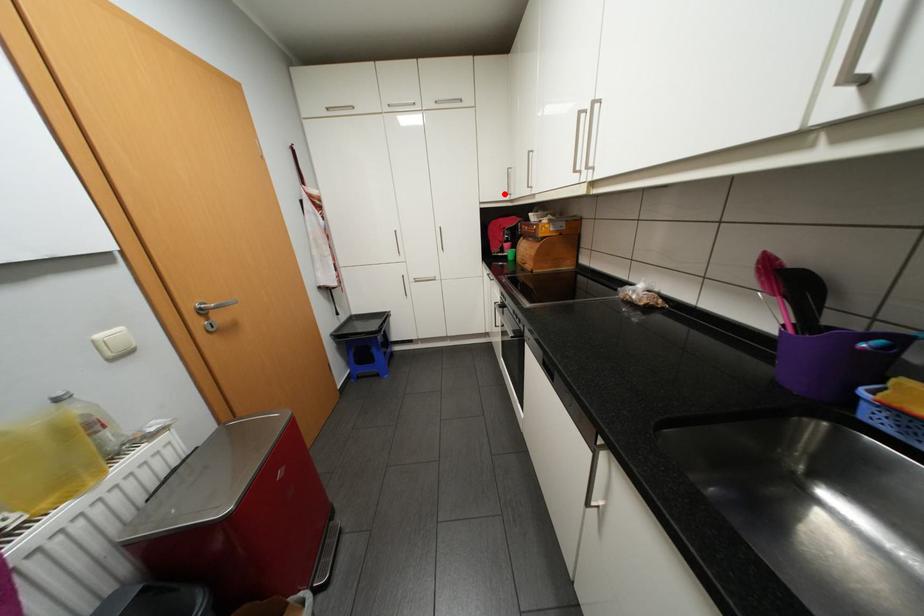
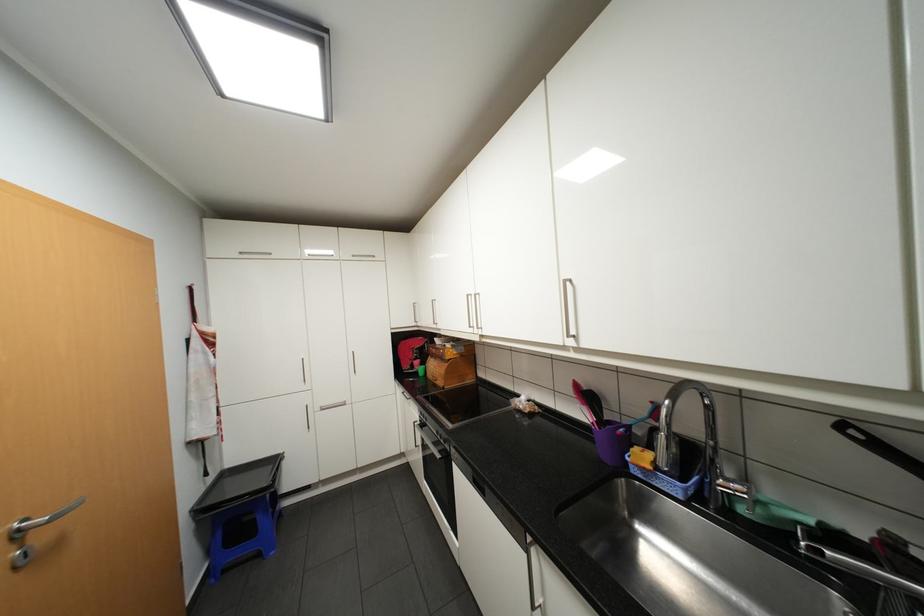
The point at the highlighted location is marked in the first image. Where is the corresponding point in the second image?

(412, 322)